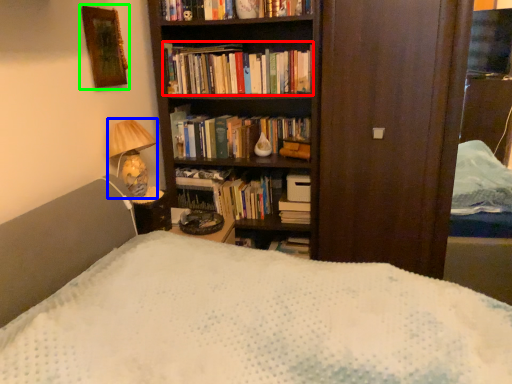
Question: Which object is the closest to the book (highlighted by a red box)? Choose among these: table lamp (highlighted by a blue box) or picture frame (highlighted by a green box).

Choices:
 (A) table lamp
 (B) picture frame

Answer: (B)